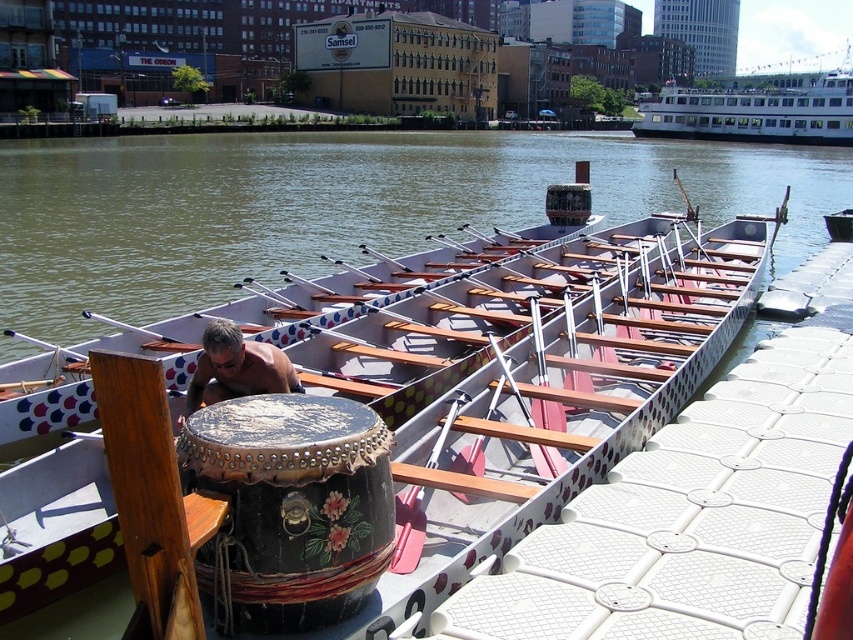
You are an event organizer planning a water parade and need to decide which vessel can accommodate more passengers. Based on the image, which one is wider between the brown wooden boat at center and the white glossy ferry at upper right?

The brown wooden boat at center is wider than the white glossy ferry at upper right, so it can accommodate more passengers.

You are a photographer planning to capture the black painted wood drum at center and the white glossy ferry at upper right in the same frame. Considering their sizes, which object will appear smaller in your photo?

The black painted wood drum at center will appear smaller in the photo because it has a lesser width compared to the white glossy ferry at upper right.

You are standing on the dock and see the point marked at coordinates (x=335, y=205) in the image. Which object is this point located on?

The point marked at coordinates (x=335, y=205) is located on the brown wooden boat at center.